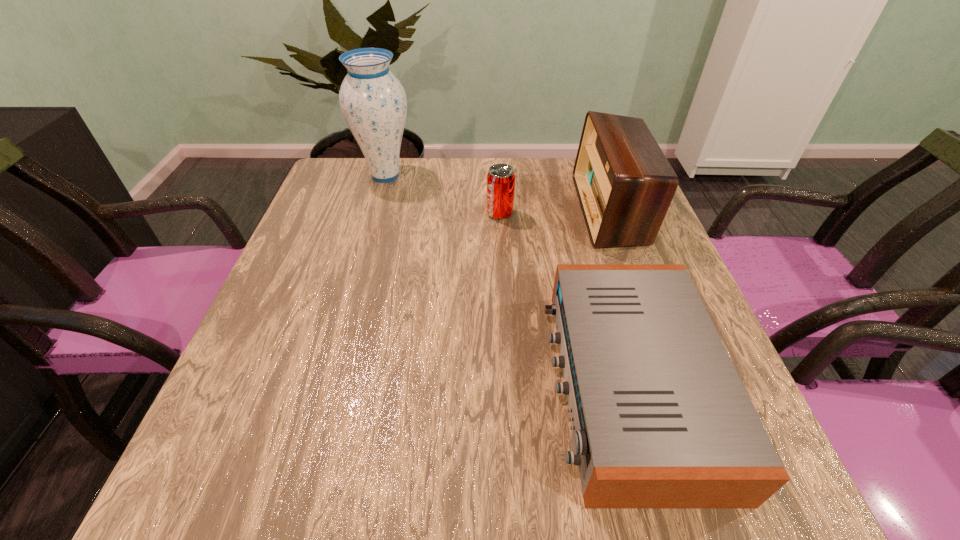
At what (x,y) coordinates should I click in order to perform the action: click on free space that is in between the tallest object and the nearer radio receiver. Please return your answer as a coordinate pair (x, y). The height and width of the screenshot is (540, 960). Looking at the image, I should click on (507, 280).

In order to click on free space between the leftmost object and the soda can in this screenshot , I will do `click(443, 195)`.

Where is `free space between the tallest object and the nearest object`? The width and height of the screenshot is (960, 540). free space between the tallest object and the nearest object is located at coordinates (507, 280).

This screenshot has width=960, height=540. What are the coordinates of `free space between the tallest object and the shorter radio receiver` in the screenshot? It's located at (507, 280).

Select which object appears as the closest to the nearer radio receiver. Please provide its 2D coordinates. Your answer should be formatted as a tuple, i.e. [(x, y)], where the tuple contains the x and y coordinates of a point satisfying the conditions above.

[(625, 184)]

Identify which object is the third nearest to the third tallest object. Please provide its 2D coordinates. Your answer should be formatted as a tuple, i.e. [(x, y)], where the tuple contains the x and y coordinates of a point satisfying the conditions above.

[(660, 418)]

Image resolution: width=960 pixels, height=540 pixels. Identify the location of blank space that satisfies the following two spatial constraints: 1. on the front side of the vase; 2. on the left side of the second object from left to right. (374, 214).